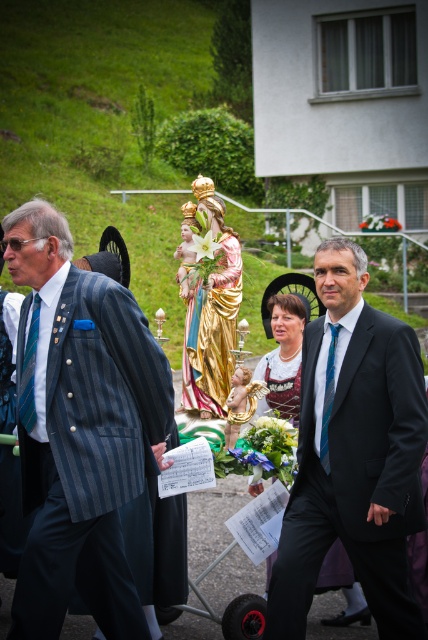
Find the location of a particular element. blue striped tie at left is located at coordinates (29, 371).

Is point (35, 413) closer to camera compared to point (326, 392)?

Yes, it is in front of point (326, 392).

Is point (29, 388) closer to camera compared to point (321, 456)?

Yes, point (29, 388) is in front of point (321, 456).

Identify the location of blue striped tie at left. This screenshot has width=428, height=640. (29, 371).

Which is more to the right, gold metallic statue at center or blue striped tie at left?

From the viewer's perspective, gold metallic statue at center appears more on the right side.

Which is in front, point (189, 372) or point (32, 330)?

Point (32, 330) is more forward.

Locate an element on the screen. This screenshot has height=640, width=428. gold metallic statue at center is located at coordinates (211, 333).

Consider the image. Does striped wool suit at left have a lesser width compared to blue striped tie at left?

No.

Which is below, striped wool suit at left or blue striped tie at left?

striped wool suit at left

Find the location of a particular element. This screenshot has width=428, height=640. striped wool suit at left is located at coordinates click(x=82, y=429).